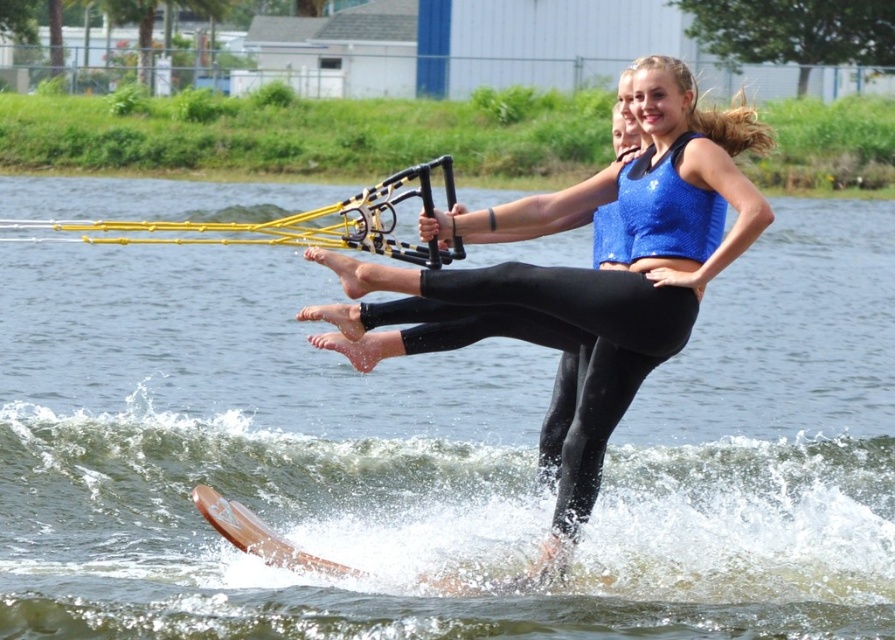
You are a photographer trying to capture the perfect shot of the shiny blue tank top at center and the wooden water ski at lower center. Based on their positions, which object should you focus on first to ensure both are in frame?

The wooden water ski at lower center should be focused on first since the shiny blue tank top at center is to its right, ensuring both are captured in the frame.

You are observing a water skiing scene. There is a point at coordinates (594, 268). What object is located at that point?

The point at coordinates (594, 268) marks the shiny blue tank top at center.

You are a photographer trying to capture the action of the water skier. Since the brown wooden water ski at center and the shiny blue tank top at center are both in the center, which one should you focus on to ensure the subject is sharp? Explain your reasoning based on their positions.

The brown wooden water ski at center is in front of the shiny blue tank top at center. To ensure the subject is sharp, focus on the brown wooden water ski at center since it is closer to the camera and will be in focus first.